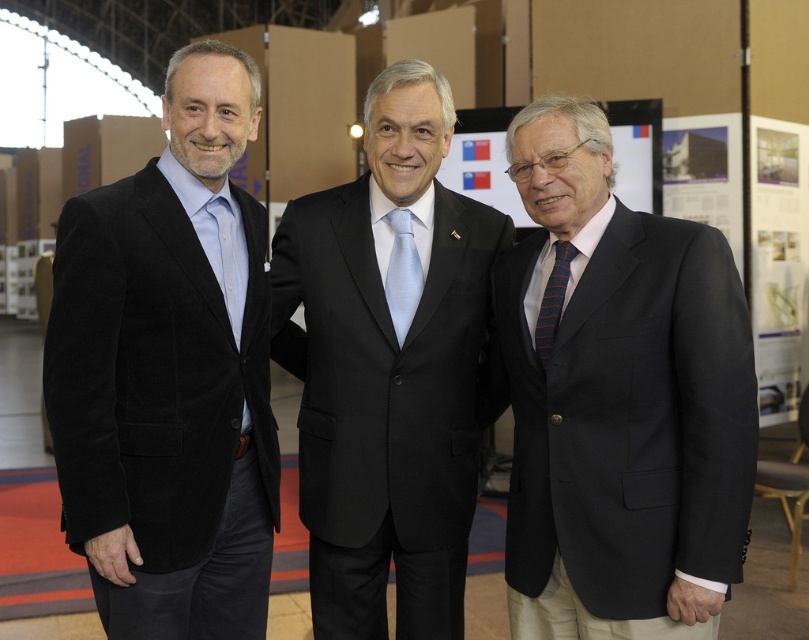
Question: Which object is farther from the camera taking this photo?

Choices:
 (A) black satin suit at center
 (B) matte black suit at right
 (C) light blue silk tie at center

Answer: (C)

Question: Which of these objects is positioned closest to the matte black suit at right?

Choices:
 (A) light blue silk tie at center
 (B) striped fabric tie at center
 (C) velvet black suit at left

Answer: (B)

Question: Is matte black suit at right below striped fabric tie at center?

Choices:
 (A) no
 (B) yes

Answer: (B)

Question: Does velvet black suit at left appear on the right side of black satin suit at center?

Choices:
 (A) no
 (B) yes

Answer: (A)

Question: Is light blue silk tie at center wider than striped fabric tie at center?

Choices:
 (A) yes
 (B) no

Answer: (A)

Question: Which object is farther from the camera taking this photo?

Choices:
 (A) matte black suit at right
 (B) velvet black suit at left
 (C) light blue silk tie at center

Answer: (C)